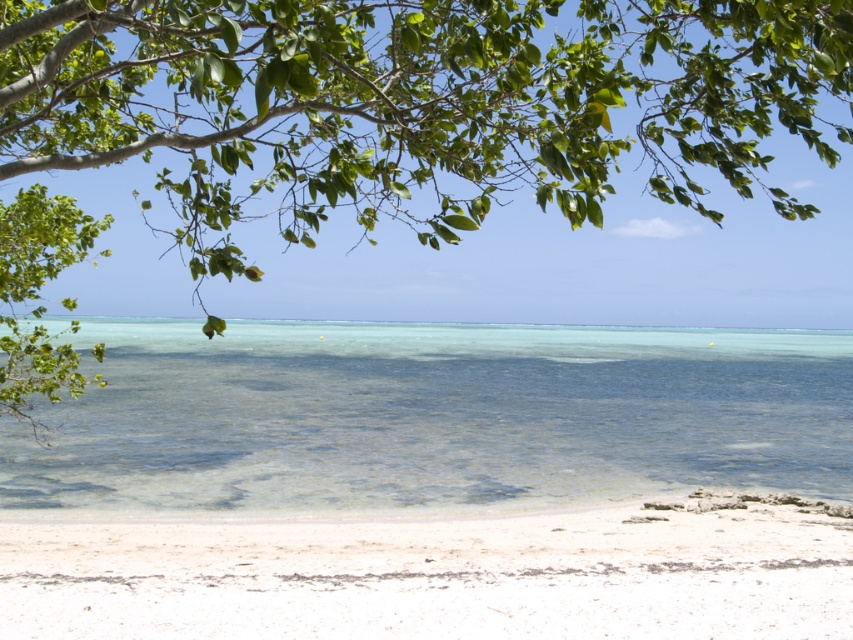
Looking at this image, you are standing at the center of the beach scene. If you look towards the upper left corner, where exactly would you find the green leafy tree at upper left?

The green leafy tree at upper left is located at coordinates point (412, 104).

You are a photographer wanting to capture the green leafy tree at upper left and the white sandy beach at lower center in a single frame. Which object will appear bigger in your photo?

The green leafy tree at upper left will appear bigger in the photo because it has a larger size compared to the white sandy beach at lower center.

You are standing at the center of the beach scene and want to take a photo of the green leafy tree at upper left. Which direction should you face to ensure the tree is in the frame?

The green leafy tree at upper left is located at the top left corner of the frame, so you should face towards the upper left direction to include it in your photo.